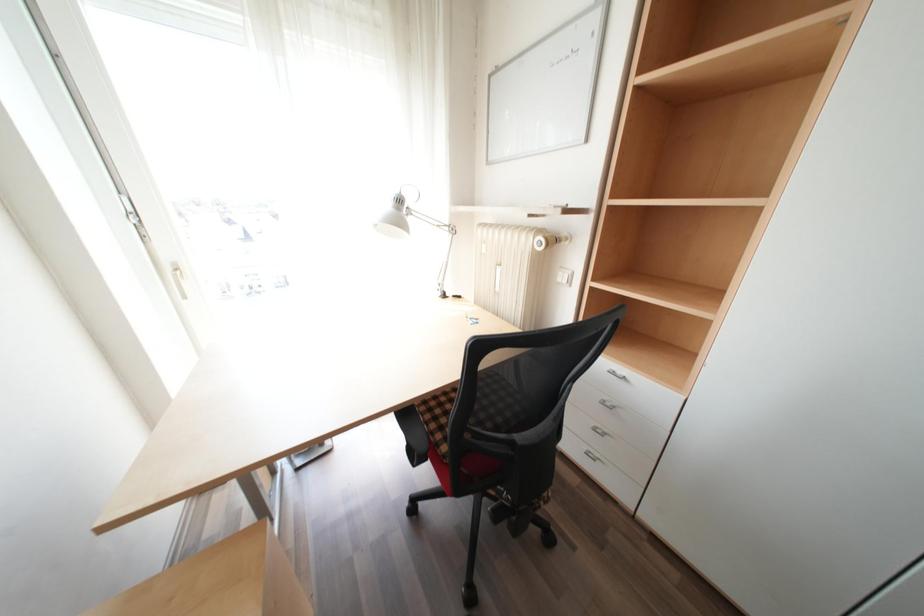
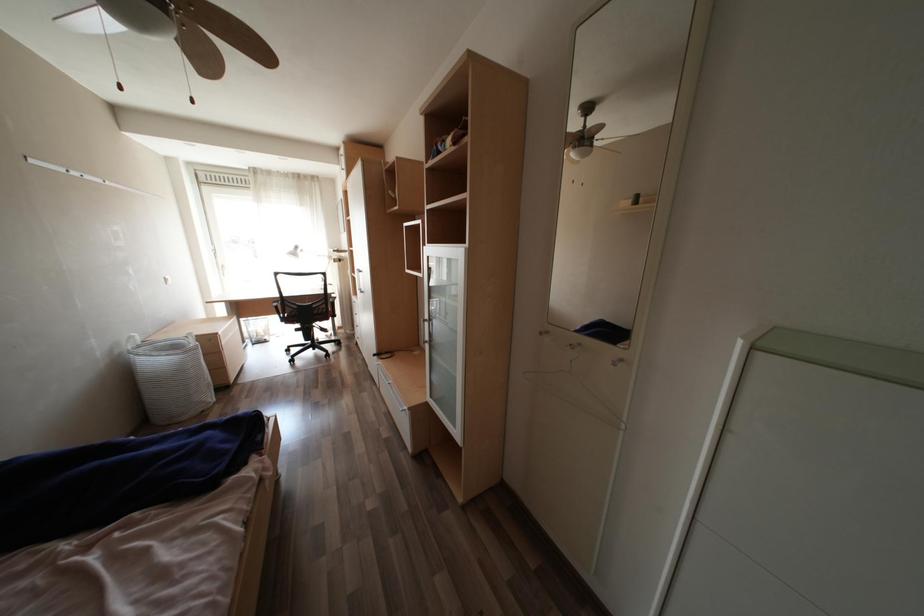
In a continuous first-person perspective shot, in which direction is the camera moving?

The movement direction of the cameraman is right, backward.